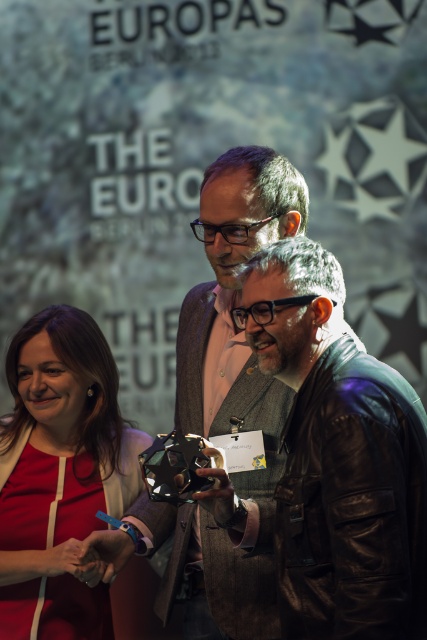
You are standing in front of the large screen with the text and stars. There are two points marked in the image, point (380, 554) and point (55, 353). Which point is nearer to you?

Point (380, 554) is closer to the viewer than point (55, 353).

You are at a formal event and notice two items of clothing. The leather jacket at center and the matte red dress at lower left. Which one is more to the right?

The leather jacket at center is more to the right side of the matte red dress at lower left.